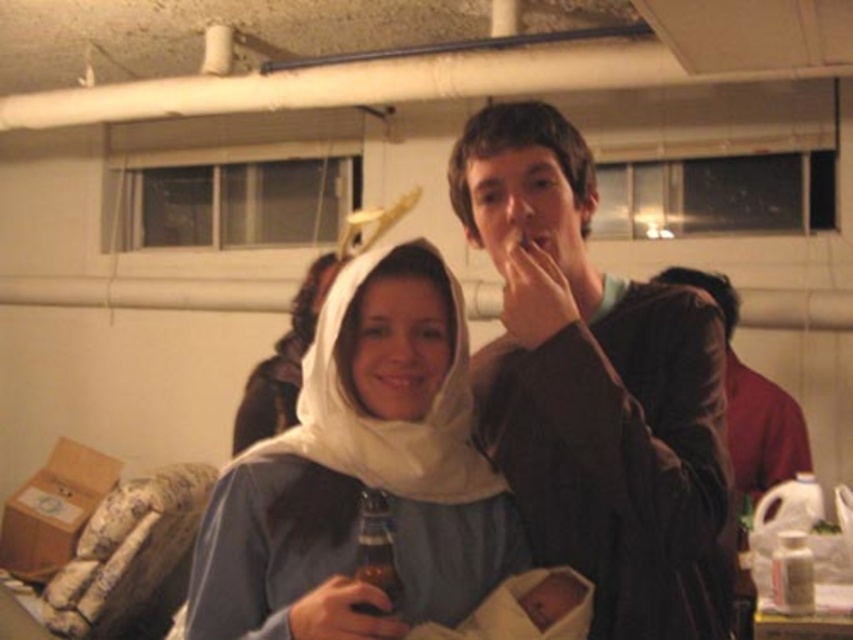
You are at the event and want to take a photo of both people in the image. To ensure both are in frame, should you position yourself closer to the point at (364, 515) or the point at (494, 545)?

You should position yourself closer to the point at (364, 515) because point at (494, 545) is behind it, so moving closer to the front point will keep both in the frame.

You are taking a photo of the two points in the image. The first point is at coordinate point (x=732, y=554) and the second point is at coordinate point (x=397, y=596). Which point appears closer to the camera in the photo?

Point (x=397, y=596) appears closer to the camera because it is closer to the camera than point (x=732, y=554), which is further away.

You are at a party and see the brown matte jacket at center and the white cloth at center. Which object is located to the right of the other?

The brown matte jacket at center is positioned on the right side of white cloth at center.